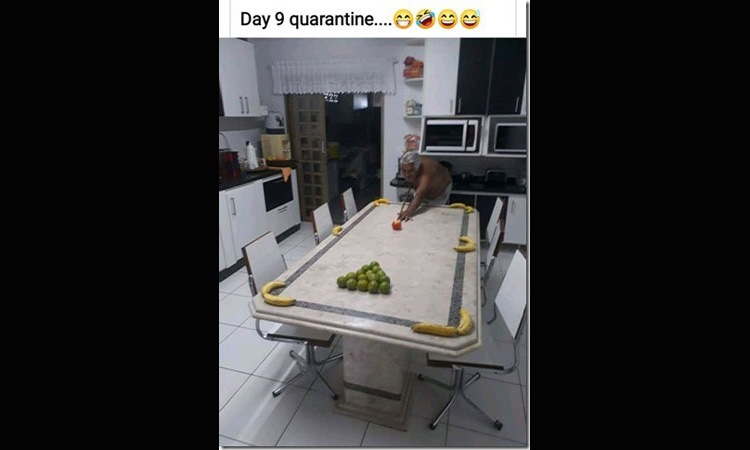
The width and height of the screenshot is (750, 450). Find the location of `kitchen table`. kitchen table is located at coordinates (309, 283).